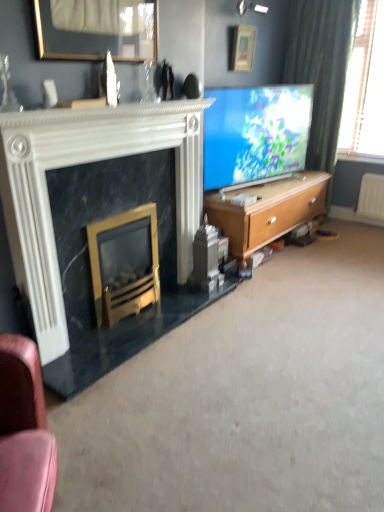
Question: Is matte white picture frame at upper center, arranged as the 1th picture frame when viewed from the back, to the left or to the right of white marble fireplace at left, which is the 2th fireplace in bottom-to-top order, in the image?

Choices:
 (A) left
 (B) right

Answer: (B)

Question: Based on their sizes in the image, would you say matte white picture frame at upper center, the first picture frame when ordered from top to bottom, is bigger or smaller than white marble fireplace at left, acting as the 1th fireplace starting from the top?

Choices:
 (A) small
 (B) big

Answer: (A)

Question: Estimate the real-world distances between objects in this image. Which object is farther from the wooden picture frame at upper center, the second picture frame when ordered from top to bottom?

Choices:
 (A) white marble fireplace at left, acting as the 1th fireplace starting from the top
 (B) matte white picture frame at upper center, the 1th picture frame when ordered from right to left
 (C) gold metallic fireplace at lower left, which is the second fireplace from top to bottom
 (D) wooden cabinet at right
 (E) matte blue screen at center

Answer: (B)

Question: Considering the real-world distances, which object is farthest from the white marble fireplace at left, acting as the 1th fireplace starting from the top?

Choices:
 (A) matte white picture frame at upper center, arranged as the 1th picture frame when viewed from the back
 (B) gold metallic fireplace at lower left, which is the second fireplace from top to bottom
 (C) wooden cabinet at right
 (D) matte blue screen at center
 (E) wooden picture frame at upper center, placed as the second picture frame when sorted from right to left

Answer: (A)